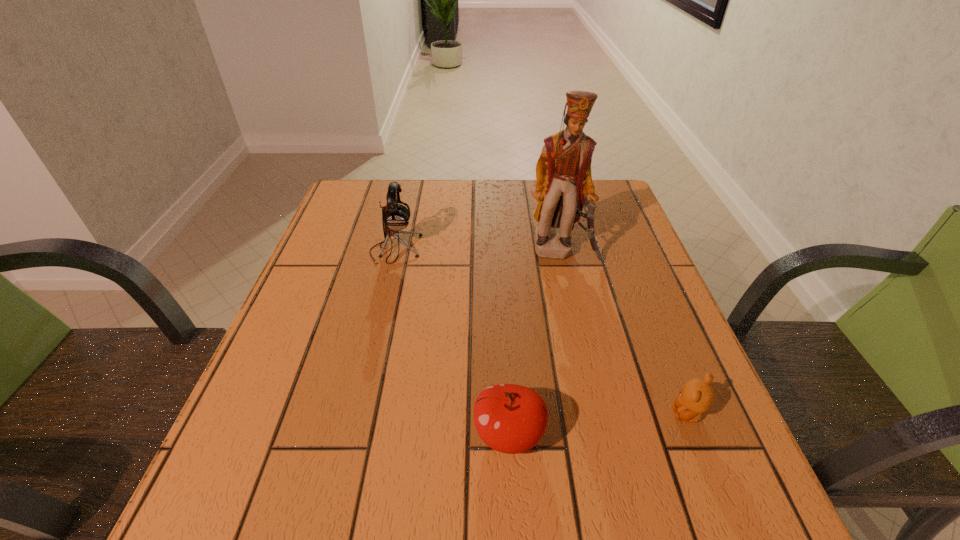
You are a GUI agent. You are given a task and a screenshot of the screen. Output one action in this format:
    pyautogui.click(x=<x>, y=<y>)
    Task: Click on the unoccupied position between the teddy bear and the apple
    The image size is (960, 540).
    Given the screenshot: What is the action you would take?
    [x=598, y=424]

Choose which object is the nearest neighbor to the shortest object. Please provide its 2D coordinates. Your answer should be formatted as a tuple, i.e. [(x, y)], where the tuple contains the x and y coordinates of a point satisfying the conditions above.

[(509, 418)]

What are the coordinates of `object identified as the closest to the second tallest object` in the screenshot? It's located at pyautogui.click(x=564, y=184).